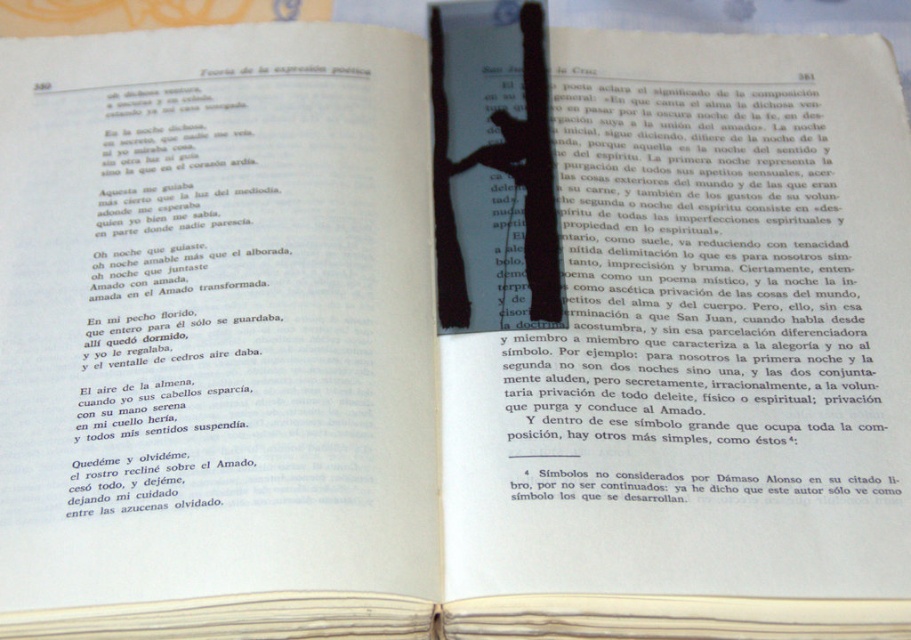
Does black paper at upper center appear over black paper bookmark at center?

No.

Is point (776, 419) closer to viewer compared to point (474, 13)?

That is True.

Locate an element on the screen. This screenshot has height=640, width=911. black paper at upper center is located at coordinates (713, 292).